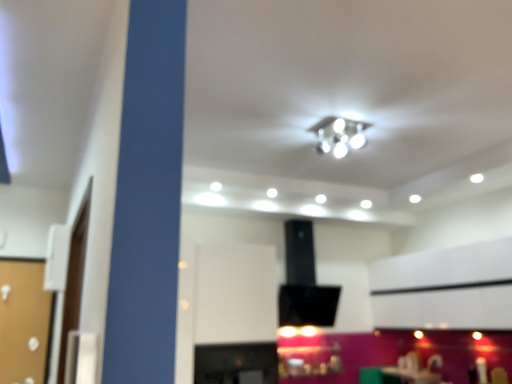
Describe the element at coordinates (339, 135) in the screenshot. The height and width of the screenshot is (384, 512). I see `white glossy light fixture at upper center` at that location.

Locate an element on the screen. white glossy light fixture at upper center is located at coordinates (339, 135).

This screenshot has width=512, height=384. What do you see at coordinates (409, 376) in the screenshot?
I see `matte white table at lower center` at bounding box center [409, 376].

Identify the location of matte white table at lower center. Image resolution: width=512 pixels, height=384 pixels. 409,376.

Identify the location of white glossy light fixture at upper center. The height and width of the screenshot is (384, 512). (339, 135).

Considering the relative positions of white glossy light fixture at upper center and matte white table at lower center in the image provided, is white glossy light fixture at upper center to the right of matte white table at lower center from the viewer's perspective?

No, white glossy light fixture at upper center is not to the right of matte white table at lower center.

Is white glossy light fixture at upper center positioned behind matte white table at lower center?

That is False.

Does point (348, 137) come in front of point (436, 374)?

Yes, it is in front of point (436, 374).

From the image's perspective, which one is positioned higher, white glossy light fixture at upper center or matte white table at lower center?

From the image's view, white glossy light fixture at upper center is above.

From a real-world perspective, who is located lower, white glossy light fixture at upper center or matte white table at lower center?

matte white table at lower center is physically lower.

Consider the image. Which of these two, white glossy light fixture at upper center or matte white table at lower center, is thinner?

With smaller width is white glossy light fixture at upper center.

Does white glossy light fixture at upper center have a lesser height compared to matte white table at lower center?

Correct, white glossy light fixture at upper center is not as tall as matte white table at lower center.

Considering the sizes of objects white glossy light fixture at upper center and matte white table at lower center in the image provided, who is bigger, white glossy light fixture at upper center or matte white table at lower center?

matte white table at lower center is bigger.

Is white glossy light fixture at upper center inside or outside of matte white table at lower center?

white glossy light fixture at upper center cannot be found inside matte white table at lower center.

Is the surface of white glossy light fixture at upper center in direct contact with matte white table at lower center?

No.

Is white glossy light fixture at upper center aimed at matte white table at lower center?

No, white glossy light fixture at upper center is not oriented towards matte white table at lower center.

Can you tell me how much white glossy light fixture at upper center and matte white table at lower center differ in facing direction?

1.97 degrees separate the facing orientations of white glossy light fixture at upper center and matte white table at lower center.

How distant is white glossy light fixture at upper center from matte white table at lower center?

white glossy light fixture at upper center and matte white table at lower center are 2.32 meters apart from each other.

The width and height of the screenshot is (512, 384). What are the coordinates of `table that is behind the white glossy light fixture at upper center` in the screenshot? It's located at (409, 376).

Considering the positions of objects matte white table at lower center and white glossy light fixture at upper center in the image provided, who is more to the left, matte white table at lower center or white glossy light fixture at upper center?

Positioned to the left is white glossy light fixture at upper center.

Relative to white glossy light fixture at upper center, is matte white table at lower center in front or behind?

matte white table at lower center is positioned farther from the viewer than white glossy light fixture at upper center.

Which point is more distant from viewer, (420, 375) or (348, 137)?

The point (420, 375) is behind.

Looking at this image, from the image's perspective, is matte white table at lower center located above or below white glossy light fixture at upper center?

matte white table at lower center is situated lower than white glossy light fixture at upper center in the image.

From a real-world perspective, is matte white table at lower center beneath white glossy light fixture at upper center?

Yes, from a real-world perspective, matte white table at lower center is below white glossy light fixture at upper center.

Based on the photo, which object is wider, matte white table at lower center or white glossy light fixture at upper center?

With larger width is matte white table at lower center.

Who is taller, matte white table at lower center or white glossy light fixture at upper center?

With more height is matte white table at lower center.

Which of these two, matte white table at lower center or white glossy light fixture at upper center, is smaller?

white glossy light fixture at upper center.

Consider the image. Is matte white table at lower center positioned beyond the bounds of white glossy light fixture at upper center?

matte white table at lower center lies outside white glossy light fixture at upper center's area.

Consider the image. Does matte white table at lower center touch white glossy light fixture at upper center?

No, matte white table at lower center is not with white glossy light fixture at upper center.

Could you tell me if matte white table at lower center is facing white glossy light fixture at upper center?

No, matte white table at lower center is not facing towards white glossy light fixture at upper center.

Can you tell me how much matte white table at lower center and white glossy light fixture at upper center differ in facing direction?

The facing directions of matte white table at lower center and white glossy light fixture at upper center are 1.97 degrees apart.

The width and height of the screenshot is (512, 384). Identify the location of lamp in front of the matte white table at lower center. (339, 135).

Locate an element on the screen. The image size is (512, 384). lamp that is on the left side of matte white table at lower center is located at coordinates (339, 135).

Find the location of a particular element. The image size is (512, 384). lamp that is above the matte white table at lower center (from the image's perspective) is located at coordinates (339, 135).